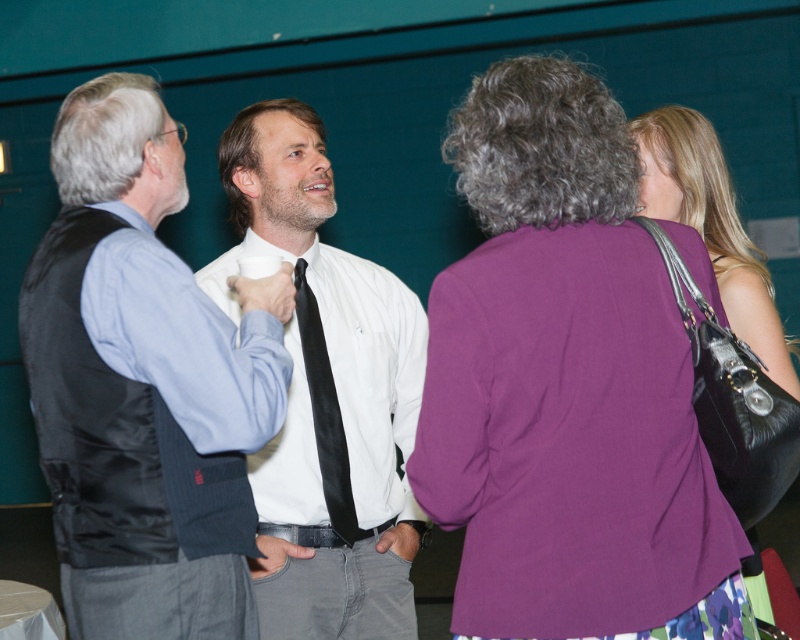
Question: Estimate the real-world distances between objects in this image. Which object is closer to the purple fabric jacket at upper right?

Choices:
 (A) matte black vest at left
 (B) black silk tie at center

Answer: (A)

Question: Which object is closer to the camera taking this photo?

Choices:
 (A) matte black vest at left
 (B) leather handbag at right
 (C) white glossy shirt at center
 (D) purple fabric jacket at upper right

Answer: (D)

Question: Observing the image, what is the correct spatial positioning of purple fabric jacket at upper right in reference to white glossy shirt at center?

Choices:
 (A) above
 (B) below

Answer: (A)

Question: Estimate the real-world distances between objects in this image. Which object is closer to the black silk tie at center?

Choices:
 (A) purple fabric jacket at upper right
 (B) leather handbag at right

Answer: (A)

Question: Can you confirm if white glossy shirt at center is bigger than black silk tie at center?

Choices:
 (A) yes
 (B) no

Answer: (A)

Question: Does purple fabric jacket at upper right come behind black silk tie at center?

Choices:
 (A) yes
 (B) no

Answer: (B)